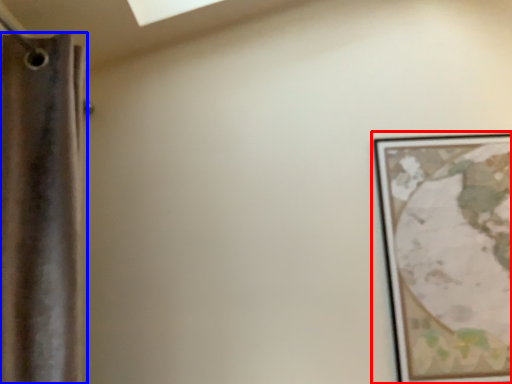
Question: Which object is further to the camera taking this photo, picture frame (highlighted by a red box) or curtain (highlighted by a blue box)?

Choices:
 (A) picture frame
 (B) curtain

Answer: (A)